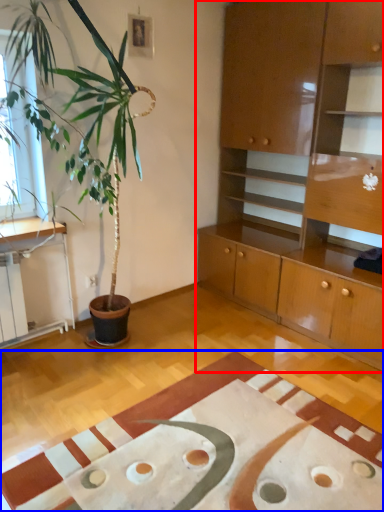
Question: Which object appears farthest to the camera in this image, cabinetry (highlighted by a red box) or plain (highlighted by a blue box)?

Choices:
 (A) cabinetry
 (B) plain

Answer: (A)